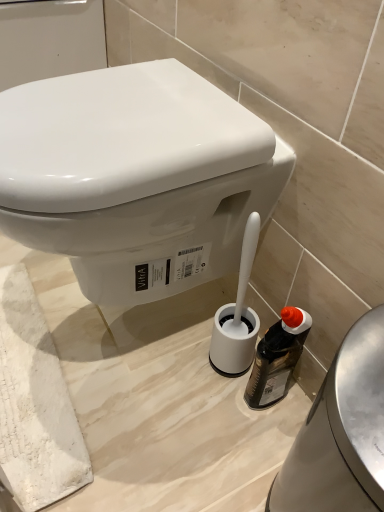
Question: Considering the positions of white glossy toilet at center and white plastic toilet brush holder at lower center in the image, is white glossy toilet at center wider or thinner than white plastic toilet brush holder at lower center?

Choices:
 (A) thin
 (B) wide

Answer: (B)

Question: Based on their positions, is white glossy toilet at center located to the left or right of white plastic toilet brush holder at lower center?

Choices:
 (A) left
 (B) right

Answer: (A)

Question: Estimate the real-world distances between objects in this image. Which object is farther from the translucent plastic bottle at lower right?

Choices:
 (A) white plastic toilet brush holder at lower center
 (B) white glossy toilet at center

Answer: (B)

Question: Considering the real-world distances, which object is closest to the translucent plastic bottle at lower right?

Choices:
 (A) white plastic toilet brush holder at lower center
 (B) white glossy toilet at center

Answer: (A)